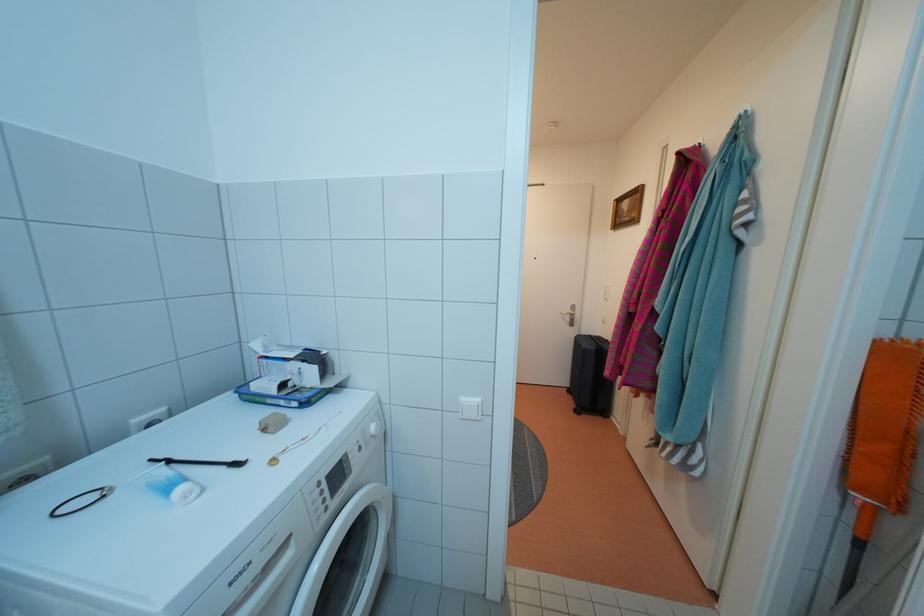
The height and width of the screenshot is (616, 924). Find the location of `duster handle`. duster handle is located at coordinates (80, 501).